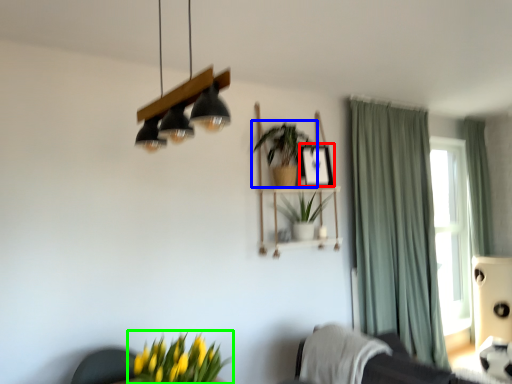
Question: Estimate the real-world distances between objects in this image. Which object is farther from picture frame (highlighted by a red box), houseplant (highlighted by a blue box) or houseplant (highlighted by a green box)?

Choices:
 (A) houseplant
 (B) houseplant

Answer: (B)